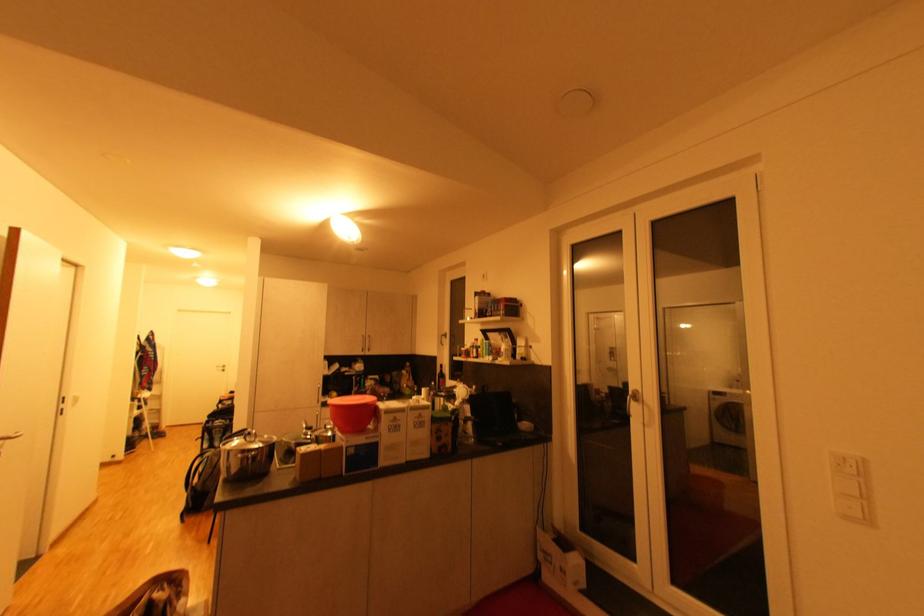
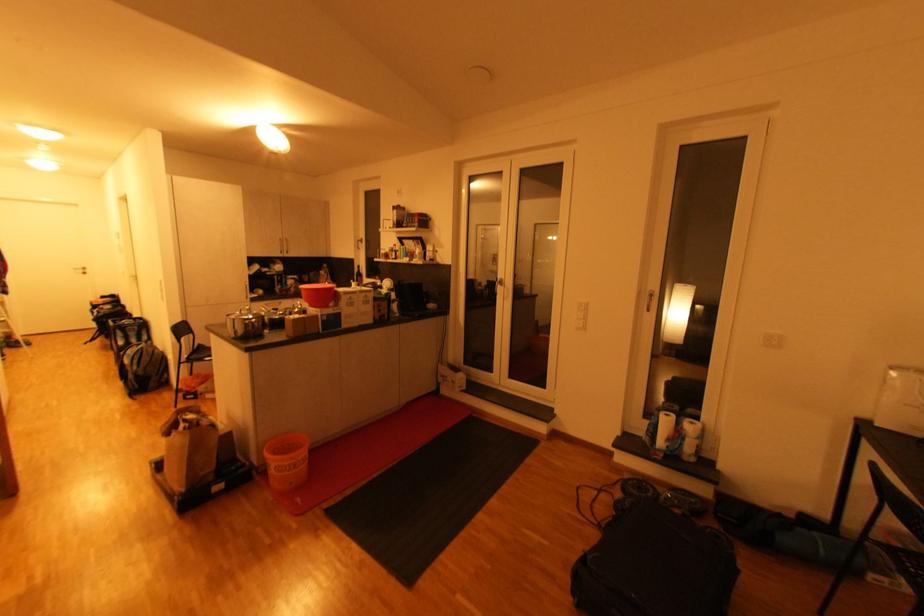
Which direction would the cameraman need to move to produce the second image?

The movement direction of the cameraman is left, backward.